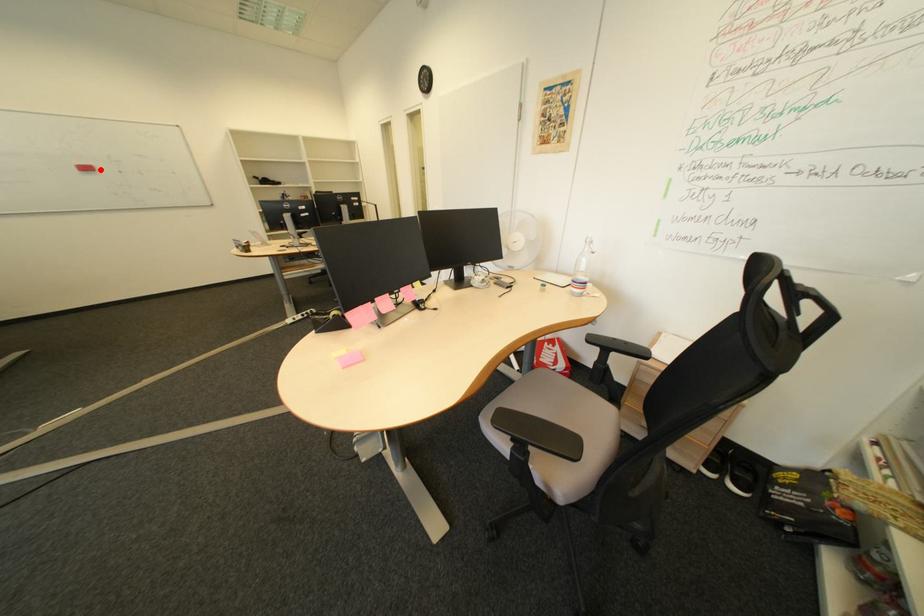
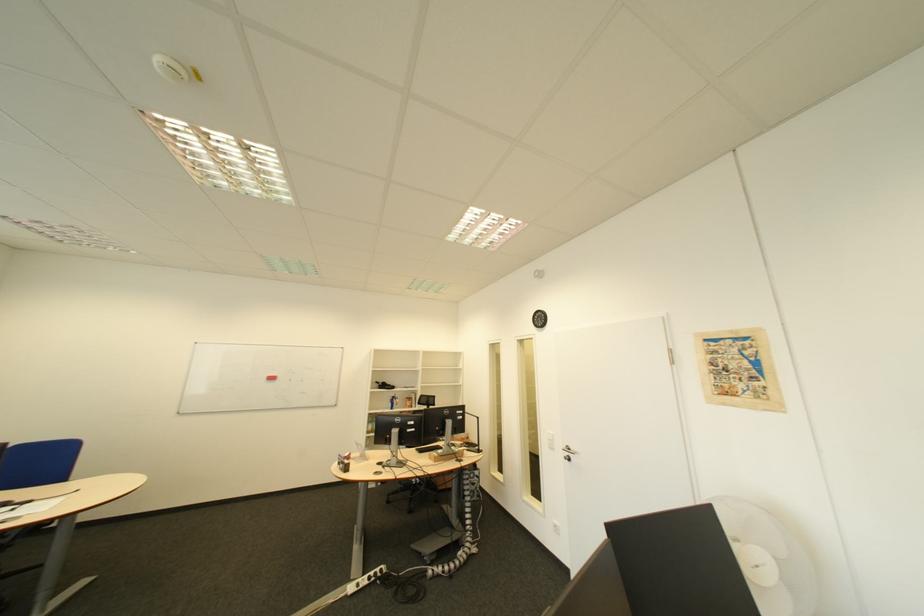
The point at the highlighted location is marked in the first image. Where is the corresponding point in the second image?

(285, 379)